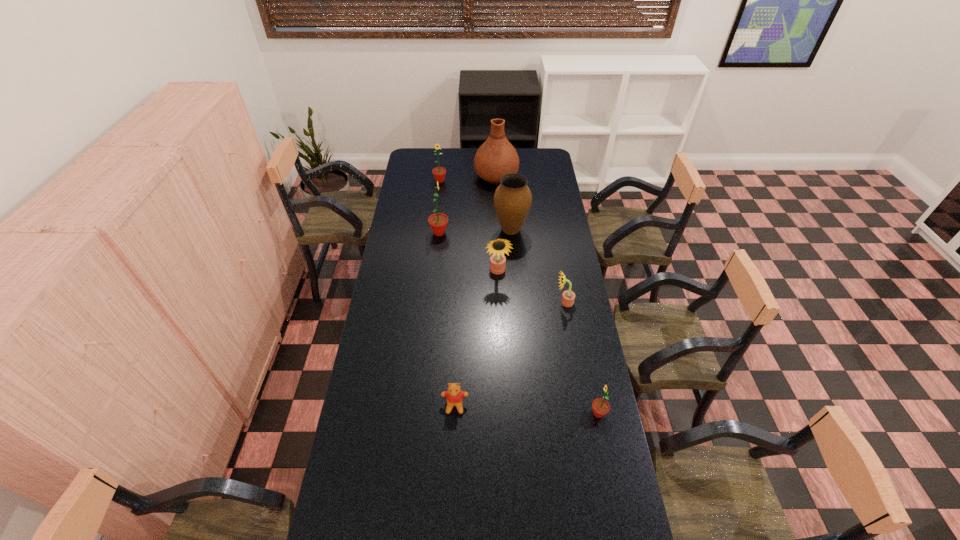
Find the location of a particular element. The width and height of the screenshot is (960, 540). the fifth closest sunflower to the pitcher is located at coordinates (600, 406).

Where is `green sunflower that can be found as the closest to the brown urn`? green sunflower that can be found as the closest to the brown urn is located at coordinates (438, 222).

Locate an element on the screen. This screenshot has height=540, width=960. the closest green sunflower to the pitcher is located at coordinates (439, 173).

I want to click on vacant space that satisfies the following two spatial constraints: 1. on the face of the nearer yellow sunflower; 2. on the front-facing side of the red teddy bear, so click(583, 405).